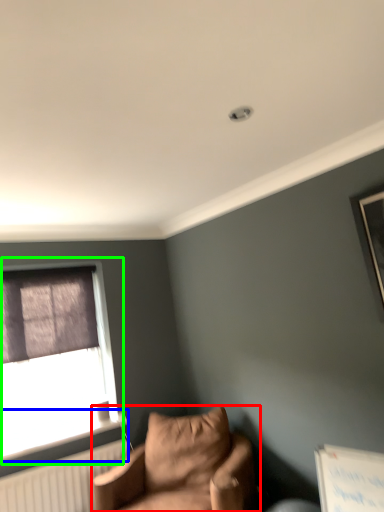
Question: Which object is the closest to the studio couch (highlighted by a red box)? Choose among these: window sill (highlighted by a blue box) or window (highlighted by a green box).

Choices:
 (A) window sill
 (B) window

Answer: (A)